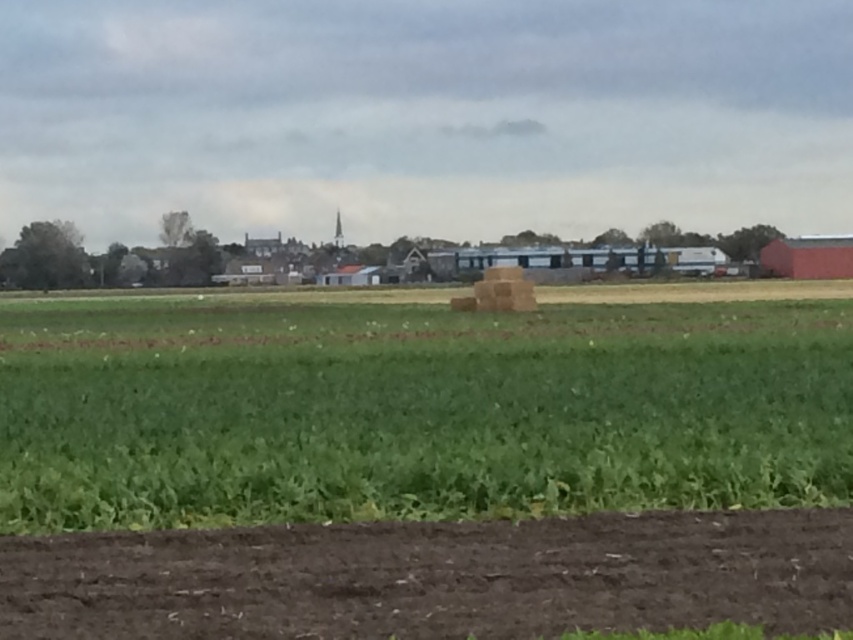
Between point (347, 504) and point (119, 570), which one is positioned in front?

Point (119, 570) is in front.

What do you see at coordinates (415, 410) in the screenshot?
I see `green grassy field at center` at bounding box center [415, 410].

The image size is (853, 640). Describe the element at coordinates (415, 410) in the screenshot. I see `green grassy field at center` at that location.

Find the location of `green grassy field at center`. green grassy field at center is located at coordinates (415, 410).